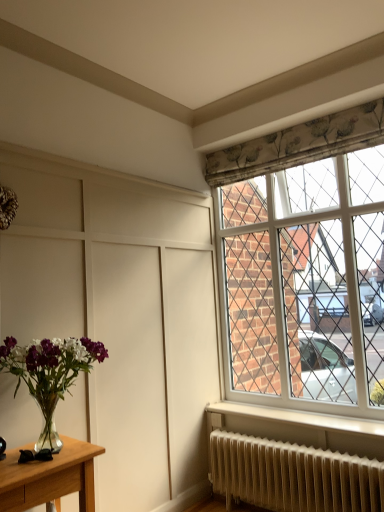
Question: Considering the relative sizes of white plastic window at upper right and clear glass vase at lower left in the image provided, is white plastic window at upper right thinner than clear glass vase at lower left?

Choices:
 (A) no
 (B) yes

Answer: (B)

Question: Is the position of white plastic window at upper right more distant than that of clear glass vase at lower left?

Choices:
 (A) yes
 (B) no

Answer: (A)

Question: Considering the relative sizes of white plastic window at upper right and clear glass vase at lower left in the image provided, is white plastic window at upper right taller than clear glass vase at lower left?

Choices:
 (A) no
 (B) yes

Answer: (B)

Question: Is white plastic window at upper right at the left side of clear glass vase at lower left?

Choices:
 (A) yes
 (B) no

Answer: (B)

Question: Can you confirm if white plastic window at upper right is wider than clear glass vase at lower left?

Choices:
 (A) no
 (B) yes

Answer: (A)

Question: Can you confirm if white plastic window at upper right is shorter than clear glass vase at lower left?

Choices:
 (A) no
 (B) yes

Answer: (A)

Question: Is white textured radiator at lower right located outside white plastic window at upper right?

Choices:
 (A) yes
 (B) no

Answer: (A)

Question: Considering the relative positions of white textured radiator at lower right and white plastic window at upper right in the image provided, is white textured radiator at lower right behind white plastic window at upper right?

Choices:
 (A) yes
 (B) no

Answer: (B)

Question: Is there a large distance between white textured radiator at lower right and white plastic window at upper right?

Choices:
 (A) no
 (B) yes

Answer: (B)

Question: Does white textured radiator at lower right have a lesser width compared to white plastic window at upper right?

Choices:
 (A) no
 (B) yes

Answer: (A)

Question: From a real-world perspective, is white textured radiator at lower right positioned under white plastic window at upper right based on gravity?

Choices:
 (A) no
 (B) yes

Answer: (B)

Question: Are white textured radiator at lower right and white plastic window at upper right making contact?

Choices:
 (A) no
 (B) yes

Answer: (A)

Question: From the image's perspective, is clear glass vase at lower left over white textured radiator at lower right?

Choices:
 (A) yes
 (B) no

Answer: (A)